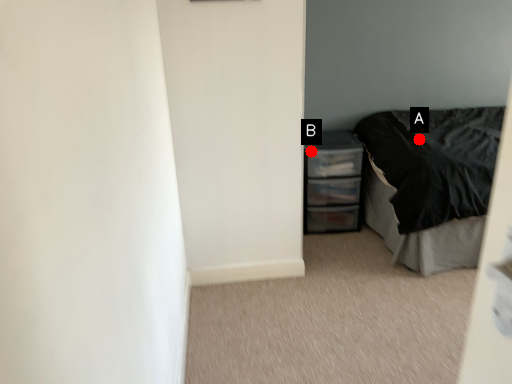
Question: Two points are circled on the image, labeled by A and B beside each circle. Which point is further to the camera?

Choices:
 (A) A is further
 (B) B is further

Answer: (B)